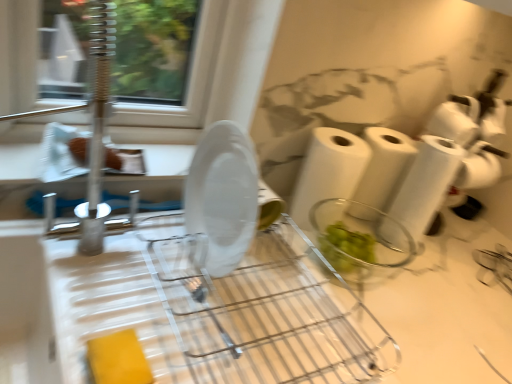
Question: Considering the relative sizes of white matte toilet paper at upper right, the fourth toilet paper ordered from the bottom, and white paper towel at center, the 2th paper towel in the left-to-right sequence, in the image provided, is white matte toilet paper at upper right, the fourth toilet paper ordered from the bottom, smaller than white paper towel at center, the 2th paper towel in the left-to-right sequence,?

Choices:
 (A) yes
 (B) no

Answer: (A)

Question: Can you confirm if white matte toilet paper at upper right, the first toilet paper when ordered from top to bottom, is bigger than white paper towel at center, the 2th paper towel in the left-to-right sequence?

Choices:
 (A) yes
 (B) no

Answer: (B)

Question: Does white matte toilet paper at upper right, the fourth toilet paper ordered from the bottom, have a greater height compared to white paper towel at center, which is counted as the 1th paper towel, starting from the right?

Choices:
 (A) yes
 (B) no

Answer: (B)

Question: Is white matte toilet paper at upper right, the first toilet paper when ordered from top to bottom, positioned beyond the bounds of white paper towel at center, which is counted as the 1th paper towel, starting from the right?

Choices:
 (A) no
 (B) yes

Answer: (B)

Question: From the image's perspective, is white matte toilet paper at upper right, the first toilet paper when ordered from top to bottom, located above white paper towel at center, which is counted as the 1th paper towel, starting from the right?

Choices:
 (A) no
 (B) yes

Answer: (B)

Question: In terms of width, does white paper towel at center, placed as the first paper towel when sorted from left to right, look wider or thinner when compared to white paper towel at center, the 2th paper towel in the left-to-right sequence?

Choices:
 (A) wide
 (B) thin

Answer: (B)

Question: Considering the positions of white paper towel at center, which is the 2th paper towel in right-to-left order, and white paper towel at center, the 2th paper towel in the left-to-right sequence, in the image, is white paper towel at center, which is the 2th paper towel in right-to-left order, bigger or smaller than white paper towel at center, the 2th paper towel in the left-to-right sequence,?

Choices:
 (A) small
 (B) big

Answer: (A)

Question: From the image's perspective, is white paper towel at center, placed as the first paper towel when sorted from left to right, located above or below white paper towel at center, the 2th paper towel in the left-to-right sequence?

Choices:
 (A) above
 (B) below

Answer: (B)

Question: In the image, is white paper towel at center, placed as the first paper towel when sorted from left to right, positioned in front of or behind white paper towel at center, which is counted as the 1th paper towel, starting from the right?

Choices:
 (A) behind
 (B) front

Answer: (B)

Question: Considering the positions of point (442, 162) and point (250, 190), is point (442, 162) closer or farther from the camera than point (250, 190)?

Choices:
 (A) farther
 (B) closer

Answer: (A)

Question: From a real-world perspective, relative to transparent plastic plate at center, is white matte toilet paper at center, the first toilet paper positioned from the bottom, vertically above or below?

Choices:
 (A) above
 (B) below

Answer: (A)

Question: Is white matte toilet paper at center, the first toilet paper positioned from the bottom, wider or thinner than transparent plastic plate at center?

Choices:
 (A) wide
 (B) thin

Answer: (B)

Question: Would you say white matte toilet paper at center, the first toilet paper positioned from the bottom, is to the left or to the right of transparent plastic plate at center in the picture?

Choices:
 (A) left
 (B) right

Answer: (B)

Question: Is white matte toilet paper at right, which is counted as the 3th toilet paper, starting from the top, in front of or behind white paper towel at right, arranged as the third toilet paper when ordered from the bottom, in the image?

Choices:
 (A) front
 (B) behind

Answer: (B)

Question: From a real-world perspective, is white matte toilet paper at right, which is counted as the 3th toilet paper, starting from the top, above or below white paper towel at right, arranged as the third toilet paper when ordered from the bottom?

Choices:
 (A) below
 (B) above

Answer: (B)